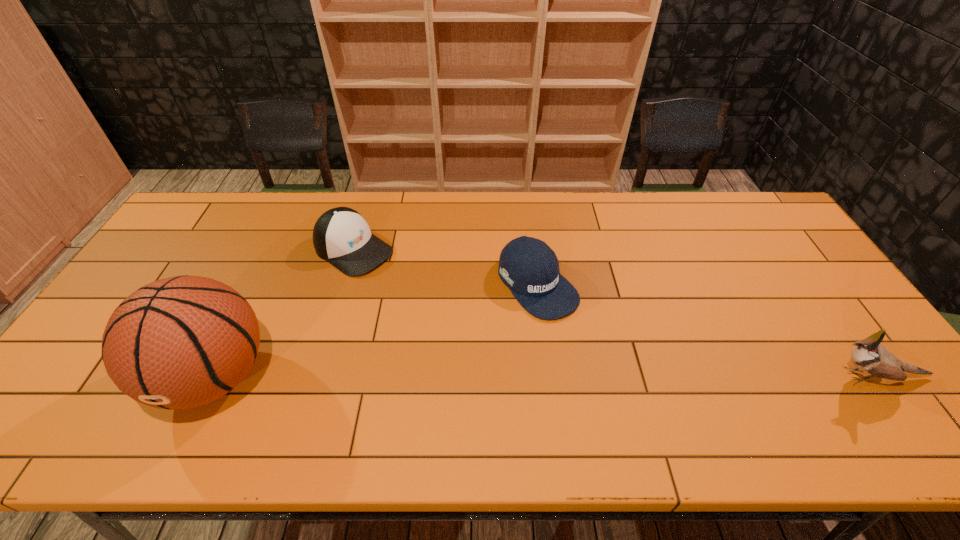
Where is `free spot on the desktop that is between the basketball and the bird and is positioned on the front panel of the cap`? This screenshot has height=540, width=960. free spot on the desktop that is between the basketball and the bird and is positioned on the front panel of the cap is located at coordinates [543, 376].

Identify the location of free space on the desktop that is between the basketball and the third shortest object and is positioned on the front-facing side of the baseball cap. This screenshot has width=960, height=540. (621, 376).